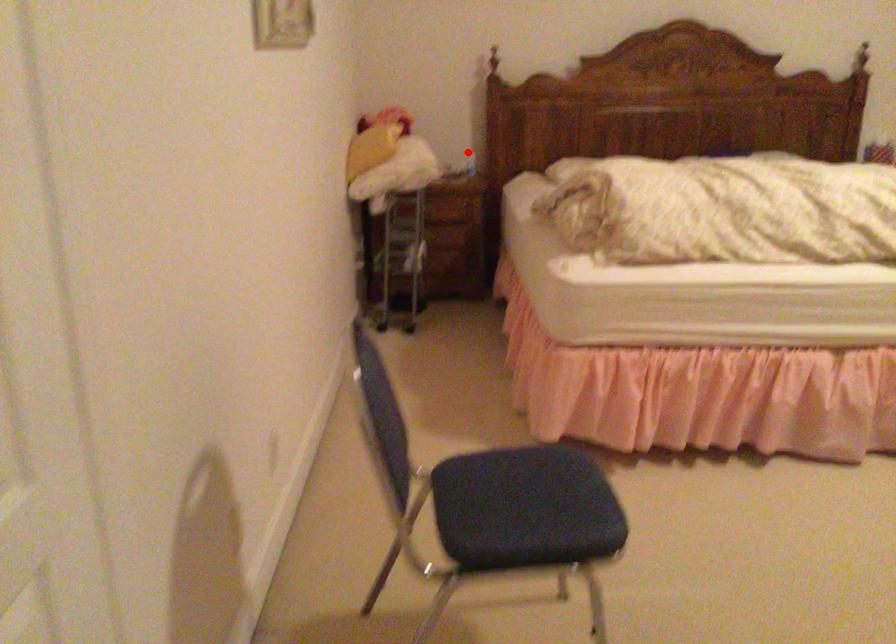
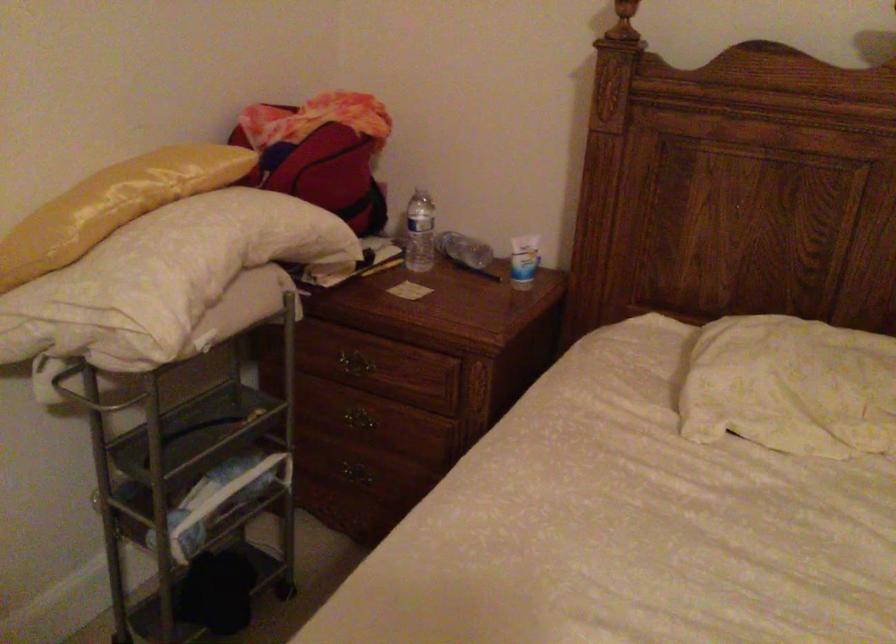
Question: I am providing you with two images of the same scene from different viewpoints. A red point is shown in image1. For the corresponding object point in image2, is it positioned nearer or farther from the camera?

Choices:
 (A) Nearer
 (B) Farther

Answer: (A)